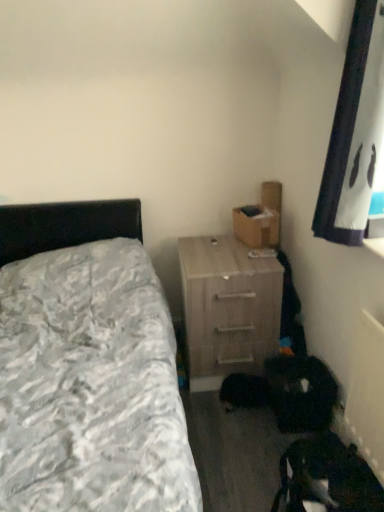
Question: Can you confirm if textured gray bedspread at left is taller than light wood/texture nightstand at center-right?

Choices:
 (A) no
 (B) yes

Answer: (B)

Question: Is textured gray bedspread at left outside of light wood/texture nightstand at center-right?

Choices:
 (A) yes
 (B) no

Answer: (A)

Question: From a real-world perspective, is textured gray bedspread at left physically below light wood/texture nightstand at center-right?

Choices:
 (A) yes
 (B) no

Answer: (B)

Question: Is textured gray bedspread at left positioned with its back to light wood/texture nightstand at center-right?

Choices:
 (A) no
 (B) yes

Answer: (A)

Question: Is textured gray bedspread at left facing towards light wood/texture nightstand at center-right?

Choices:
 (A) no
 (B) yes

Answer: (A)

Question: Is textured gray bedspread at left positioned far away from light wood/texture nightstand at center-right?

Choices:
 (A) no
 (B) yes

Answer: (A)

Question: Can you confirm if light wood/texture nightstand at center-right is shorter than textured gray bedspread at left?

Choices:
 (A) no
 (B) yes

Answer: (B)

Question: Is light wood/texture nightstand at center-right smaller than textured gray bedspread at left?

Choices:
 (A) no
 (B) yes

Answer: (B)

Question: Can you confirm if light wood/texture nightstand at center-right is thinner than textured gray bedspread at left?

Choices:
 (A) yes
 (B) no

Answer: (A)

Question: Considering the relative sizes of light wood/texture nightstand at center-right and textured gray bedspread at left in the image provided, is light wood/texture nightstand at center-right bigger than textured gray bedspread at left?

Choices:
 (A) yes
 (B) no

Answer: (B)

Question: From a real-world perspective, is light wood/texture nightstand at center-right below textured gray bedspread at left?

Choices:
 (A) yes
 (B) no

Answer: (A)

Question: Is light wood/texture nightstand at center-right at the right side of textured gray bedspread at left?

Choices:
 (A) no
 (B) yes

Answer: (B)

Question: Can you confirm if light wood/texture nightstand at center-right is thinner than brown cardboard box at upper right?

Choices:
 (A) no
 (B) yes

Answer: (A)